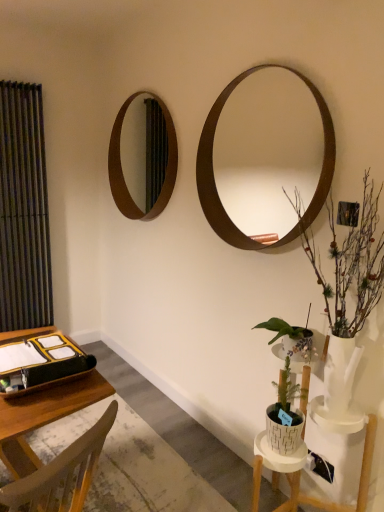
Question: From a real-world perspective, is brown wooden mirror at upper left, the second mirror in the right-to-left sequence, above or below wooden desk at lower left?

Choices:
 (A) above
 (B) below

Answer: (A)

Question: From the image's perspective, is brown wooden mirror at upper left, marked as the 1th mirror in a back-to-front arrangement, located above or below wooden desk at lower left?

Choices:
 (A) below
 (B) above

Answer: (B)

Question: Which is nearer to the wooden desk at lower left?

Choices:
 (A) white textured pot at lower right, acting as the 1th houseplant starting from the bottom
 (B) brown wooden mirror at upper right, acting as the 1th mirror starting from the front
 (C) matte black binder at lower left
 (D) brown wooden mirror at upper left, the 1th mirror positioned from the left
 (E) white textured vase at right, the second houseplant when ordered from bottom to top

Answer: (C)

Question: Based on their relative distances, which object is farther from the wooden desk at lower left?

Choices:
 (A) white textured pot at lower right, acting as the 1th houseplant starting from the bottom
 (B) matte black curtain at left
 (C) white textured vase at right, positioned as the 1th houseplant in top-to-bottom order
 (D) matte black binder at lower left
 (E) brown wooden mirror at upper right, placed as the first mirror when sorted from right to left

Answer: (E)